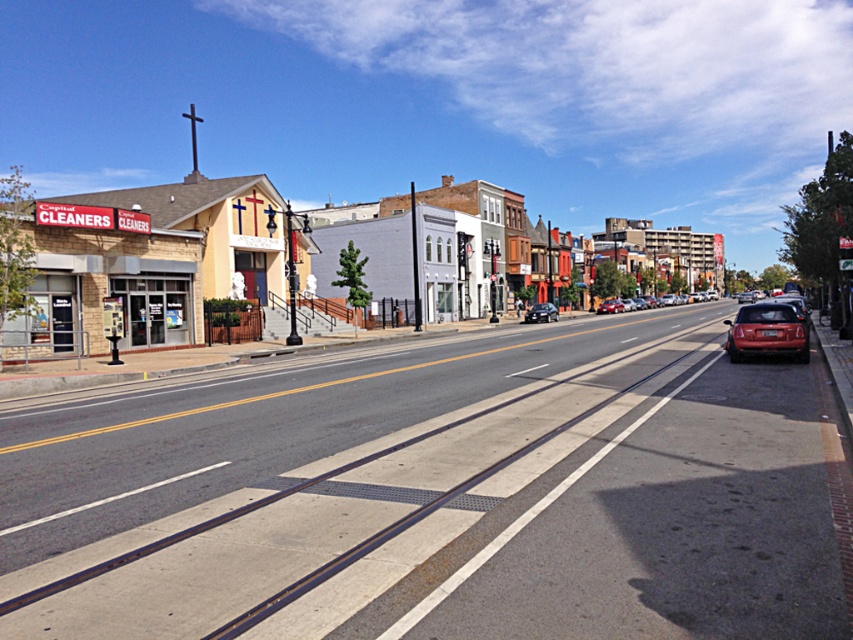
Question: Does matte red car at right appear under matte red car at center?

Choices:
 (A) yes
 (B) no

Answer: (A)

Question: Which of the following is the closest to the observer?

Choices:
 (A) (610, 298)
 (B) (694, 300)
 (C) (541, 321)

Answer: (C)

Question: Is matte red car at right bigger than matte red car at center?

Choices:
 (A) no
 (B) yes

Answer: (A)

Question: Which point appears closest to the camera in this image?

Choices:
 (A) (677, 296)
 (B) (543, 304)

Answer: (B)

Question: Estimate the real-world distances between objects in this image. Which object is farther from the matte red car at center?

Choices:
 (A) matte red sedan at center
 (B) matte red car at right
 (C) satin black sedan at center

Answer: (B)

Question: Does matte red car at right appear on the right side of satin black sedan at center?

Choices:
 (A) no
 (B) yes

Answer: (B)